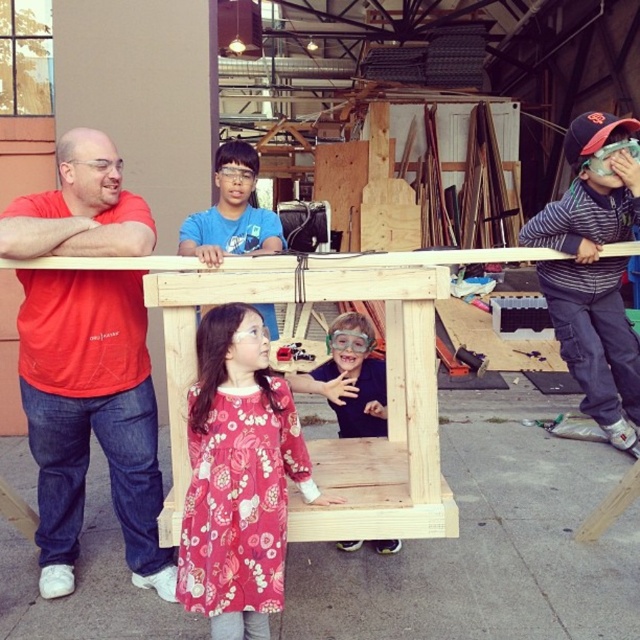
Which of these two, blue cotton shirt at upper center or matte black shirt at center, stands shorter?

matte black shirt at center is shorter.

Measure the distance between blue cotton shirt at upper center and camera.

blue cotton shirt at upper center is 2.51 meters from camera.

You are a GUI agent. You are given a task and a screenshot of the screen. Output one action in this format:
    pyautogui.click(x=<x>, y=<y>)
    Task: Click on the blue cotton shirt at upper center
    The width and height of the screenshot is (640, 640).
    Given the screenshot: What is the action you would take?
    coord(230,212)

Consider the image. Between matte red shirt at upper left and striped knit sweater at right, which one appears on the left side from the viewer's perspective?

Positioned to the left is matte red shirt at upper left.

Looking at this image, between matte red shirt at upper left and striped knit sweater at right, which one has more height?

With more height is matte red shirt at upper left.

Is point (22, 400) farther from viewer compared to point (573, 266)?

No, it is in front of (573, 266).

Find the location of a particular element. The height and width of the screenshot is (640, 640). matte red shirt at upper left is located at coordinates (90, 417).

What do you see at coordinates (595, 269) in the screenshot? I see `striped knit sweater at right` at bounding box center [595, 269].

Locate an element on the screen. The image size is (640, 640). striped knit sweater at right is located at coordinates (595, 269).

Describe the element at coordinates (595, 269) in the screenshot. I see `striped knit sweater at right` at that location.

The width and height of the screenshot is (640, 640). I want to click on striped knit sweater at right, so click(595, 269).